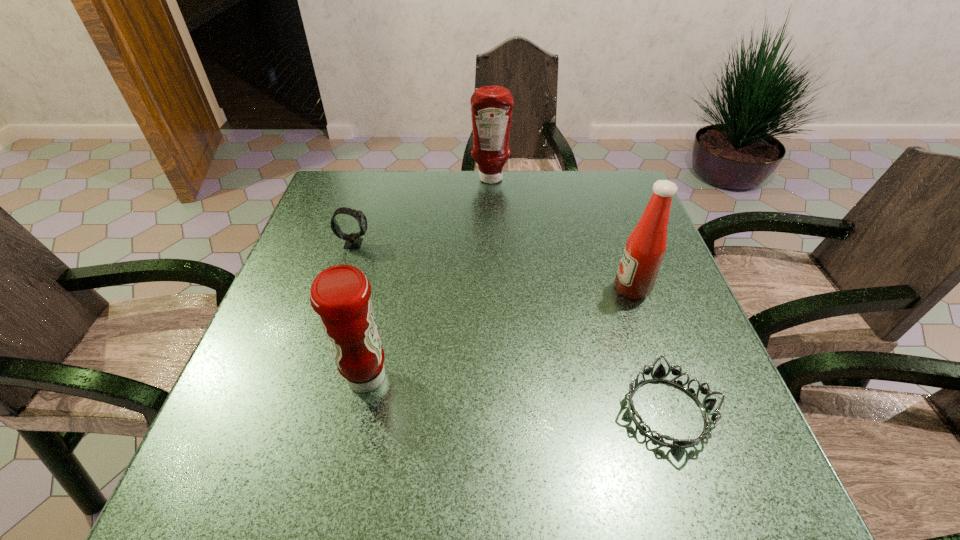
Identify the location of vacant area between the second condiment from right to left and the third farthest object. The width and height of the screenshot is (960, 540). (562, 234).

Image resolution: width=960 pixels, height=540 pixels. Find the location of `empty location between the second object from left to right and the tiara`. empty location between the second object from left to right and the tiara is located at coordinates (516, 394).

Find the location of a particular element. vacant region between the leftmost condiment and the third farthest object is located at coordinates (499, 333).

Identify the location of empty location between the watch and the tiara. (511, 327).

At what (x,y) coordinates should I click in order to perform the action: click on free space that is in between the second farthest condiment and the second object from left to right. Please return your answer as a coordinate pair (x, y). Looking at the image, I should click on (499, 333).

In order to click on vacant area that lies between the shortest object and the leftmost condiment in this screenshot , I will do `click(516, 394)`.

The height and width of the screenshot is (540, 960). Identify the location of blank region between the third object from left to right and the tiara. (579, 295).

Find the location of `object that is the fourth closest to the nearest condiment`. object that is the fourth closest to the nearest condiment is located at coordinates (491, 106).

Identify the location of object that ranks as the closest to the farthest condiment. (353, 241).

Choose which condiment is the second nearest neighbor to the second object from left to right. Please provide its 2D coordinates. Your answer should be formatted as a tuple, i.e. [(x, y)], where the tuple contains the x and y coordinates of a point satisfying the conditions above.

[(491, 106)]